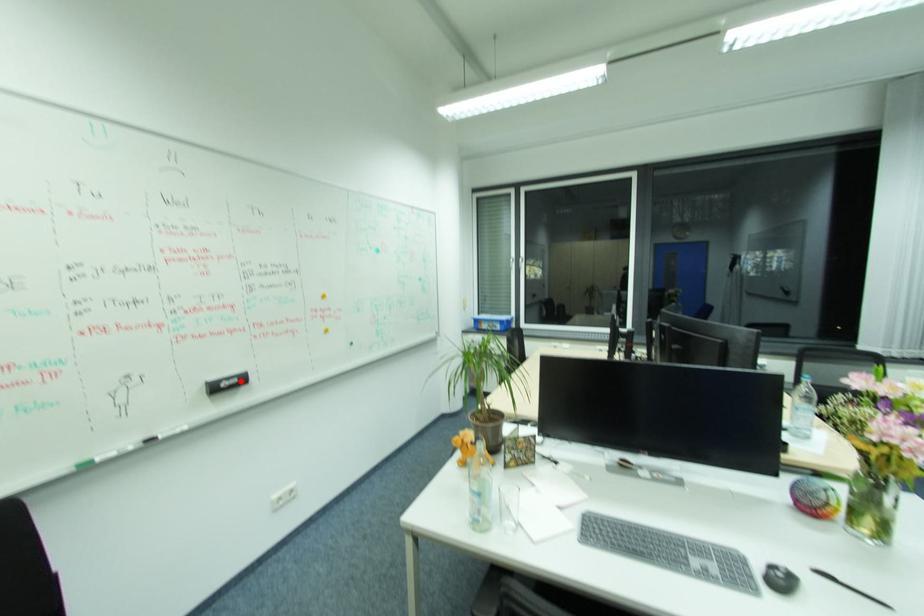
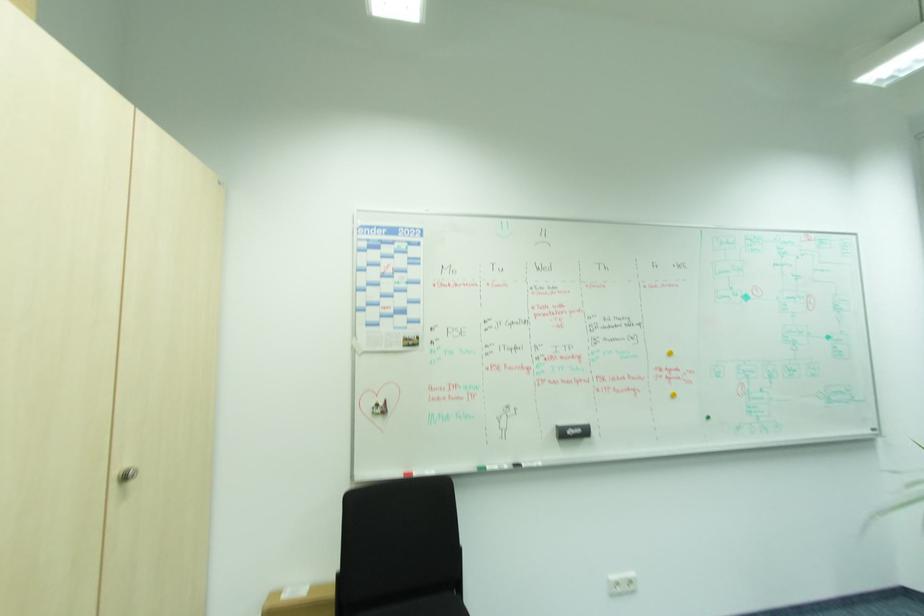
In the second image, find the point that corresponds to the highlighted location in the first image.

(584, 430)